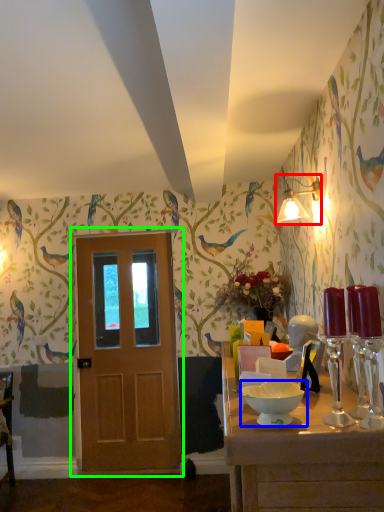
Question: Which object is positioned closest to light fixture (highlighted by a red box)? Select from bowl (highlighted by a blue box) and door (highlighted by a green box).

Choices:
 (A) bowl
 (B) door

Answer: (B)